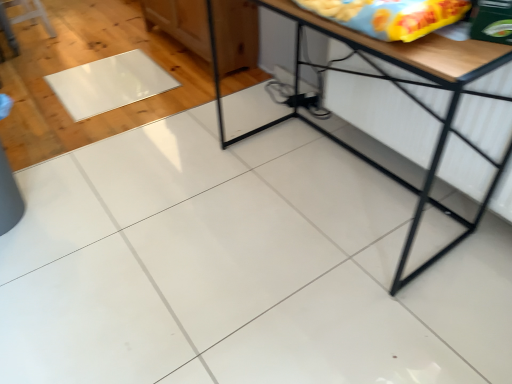
This screenshot has width=512, height=384. Find the location of `black metal table at lower right`. black metal table at lower right is located at coordinates (401, 91).

Describe the element at coordinates (401, 91) in the screenshot. The image size is (512, 384). I see `black metal table at lower right` at that location.

Locate an element on the screen. The width and height of the screenshot is (512, 384). black metal table at lower right is located at coordinates (x=401, y=91).